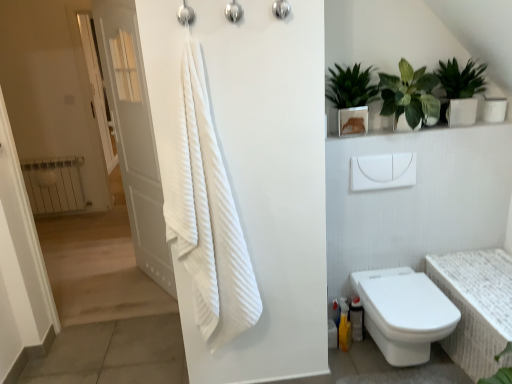
Question: In terms of size, does brushed metal shower at upper center, which appears as the 1th shower when viewed from the left, appear bigger or smaller than green glossy plant at upper right, which appears as the 1th houseplant when viewed from the left?

Choices:
 (A) big
 (B) small

Answer: (B)

Question: Considering the positions of brushed metal shower at upper center, which appears as the 1th shower when viewed from the left, and green glossy plant at upper right, which appears as the 1th houseplant when viewed from the left, in the image, is brushed metal shower at upper center, which appears as the 1th shower when viewed from the left, wider or thinner than green glossy plant at upper right, which appears as the 1th houseplant when viewed from the left,?

Choices:
 (A) thin
 (B) wide

Answer: (A)

Question: Which is nearer to the green glossy plant at upper right, which appears as the 1th houseplant when viewed from the left?

Choices:
 (A) green leafy plant at upper right, arranged as the 2th houseplant when viewed from the left
 (B) white textured towel at center
 (C) brushed metal shower at upper center, which appears as the 1th shower when viewed from the left
 (D) white wood door at left
 (E) white plastic towel bar at upper center

Answer: (A)

Question: Considering the real-world distances, which object is farthest from the white glossy toilet at lower right?

Choices:
 (A) metallic silver shower head at upper center, the first shower viewed from the right
 (B) brushed metal shower at upper center, which appears as the 1th shower when viewed from the left
 (C) white textured bath at lower right
 (D) white metallic radiator at left
 (E) green glossy plant at upper right, the 3th houseplant from the left

Answer: (D)